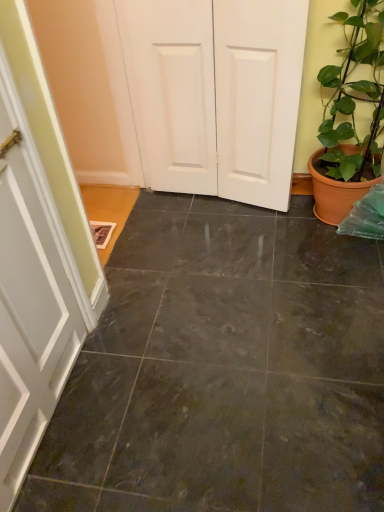
Question: Does green glossy plant at right have a greater width compared to dark gray tile floor at center?

Choices:
 (A) yes
 (B) no

Answer: (B)

Question: Is the depth of green glossy plant at right greater than that of dark gray tile floor at center?

Choices:
 (A) yes
 (B) no

Answer: (A)

Question: Is green glossy plant at right bigger than dark gray tile floor at center?

Choices:
 (A) yes
 (B) no

Answer: (A)

Question: Is green glossy plant at right oriented away from dark gray tile floor at center?

Choices:
 (A) yes
 (B) no

Answer: (B)

Question: Can you confirm if green glossy plant at right is smaller than dark gray tile floor at center?

Choices:
 (A) no
 (B) yes

Answer: (A)

Question: Is green glossy plant at right taller than dark gray tile floor at center?

Choices:
 (A) no
 (B) yes

Answer: (B)

Question: Is dark gray tile floor at center touching green glossy plant at right?

Choices:
 (A) no
 (B) yes

Answer: (A)

Question: Considering the relative positions of dark gray tile floor at center and green glossy plant at right in the image provided, is dark gray tile floor at center to the left of green glossy plant at right from the viewer's perspective?

Choices:
 (A) no
 (B) yes

Answer: (B)

Question: Can you confirm if dark gray tile floor at center is smaller than green glossy plant at right?

Choices:
 (A) no
 (B) yes

Answer: (B)

Question: Considering the relative sizes of dark gray tile floor at center and green glossy plant at right in the image provided, is dark gray tile floor at center shorter than green glossy plant at right?

Choices:
 (A) yes
 (B) no

Answer: (A)

Question: From the image's perspective, would you say dark gray tile floor at center is shown under green glossy plant at right?

Choices:
 (A) yes
 (B) no

Answer: (A)

Question: Considering the relative sizes of dark gray tile floor at center and green glossy plant at right in the image provided, is dark gray tile floor at center bigger than green glossy plant at right?

Choices:
 (A) no
 (B) yes

Answer: (A)

Question: Does white matte door at center appear on the left side of dark gray tile floor at center?

Choices:
 (A) no
 (B) yes

Answer: (B)